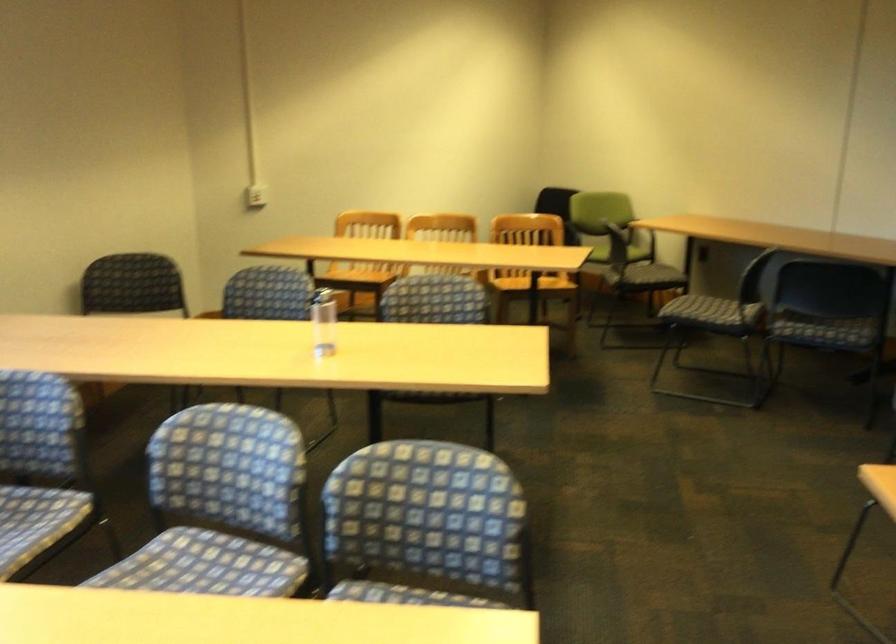
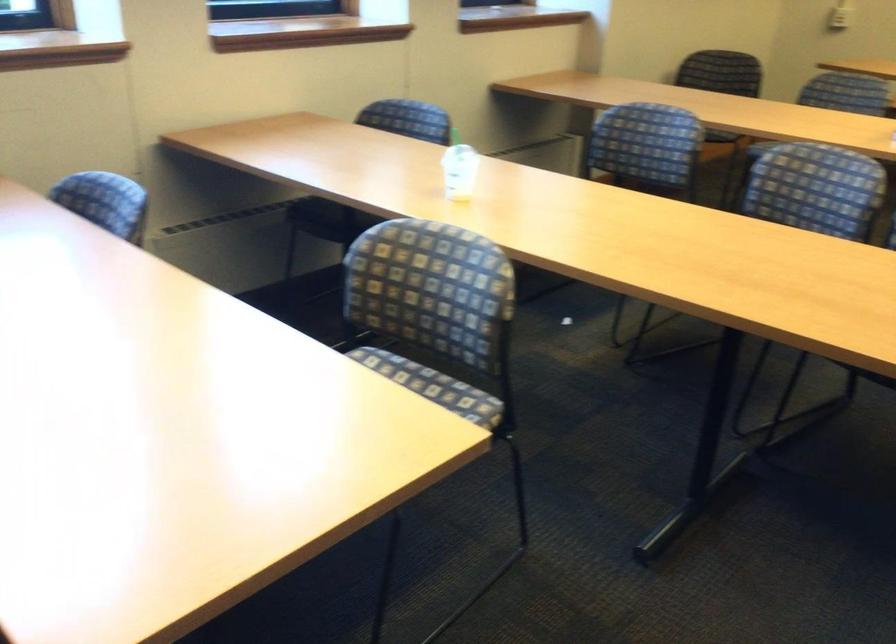
Question: Based on the continuous images, in which direction is the camera rotating? Reply with the corresponding letter.

Choices:
 (A) Left
 (B) Right
 (C) Up
 (D) Down

Answer: (A)